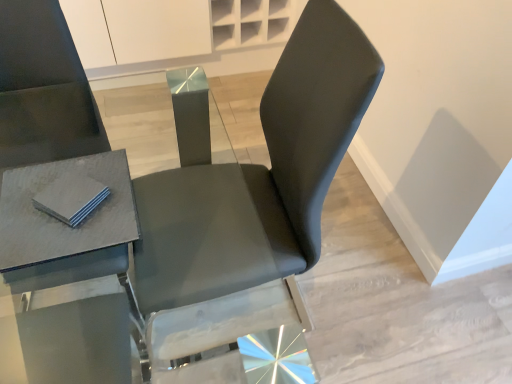
Question: Should I look upward or downward to see gray matte pad at upper left?

Choices:
 (A) up
 (B) down

Answer: (B)

Question: From a real-world perspective, is gray matte pad at upper left below matte gray table at left?

Choices:
 (A) no
 (B) yes

Answer: (A)

Question: Can you confirm if gray matte pad at upper left is shorter than matte gray table at left?

Choices:
 (A) no
 (B) yes

Answer: (B)

Question: Does gray matte pad at upper left have a smaller size compared to matte gray table at left?

Choices:
 (A) yes
 (B) no

Answer: (A)

Question: Is gray matte pad at upper left positioned with its back to matte gray table at left?

Choices:
 (A) no
 (B) yes

Answer: (A)

Question: Does gray matte pad at upper left have a greater height compared to matte gray table at left?

Choices:
 (A) yes
 (B) no

Answer: (B)

Question: Is the depth of gray matte pad at upper left less than that of matte gray table at left?

Choices:
 (A) no
 (B) yes

Answer: (A)

Question: Is the depth of matte gray table at left greater than that of gray matte pad at upper left?

Choices:
 (A) yes
 (B) no

Answer: (B)

Question: Is matte gray table at left shorter than gray matte pad at upper left?

Choices:
 (A) no
 (B) yes

Answer: (A)

Question: Is matte gray table at left located outside gray matte pad at upper left?

Choices:
 (A) yes
 (B) no

Answer: (A)

Question: Considering the relative positions of matte gray table at left and gray matte pad at upper left in the image provided, is matte gray table at left to the left of gray matte pad at upper left from the viewer's perspective?

Choices:
 (A) yes
 (B) no

Answer: (A)

Question: From a real-world perspective, is matte gray table at left over gray matte pad at upper left?

Choices:
 (A) no
 (B) yes

Answer: (A)

Question: Is matte gray table at left to the right of gray matte pad at upper left from the viewer's perspective?

Choices:
 (A) no
 (B) yes

Answer: (A)

Question: Can you confirm if matte gray table at left is shorter than matte black chair at center?

Choices:
 (A) no
 (B) yes

Answer: (A)